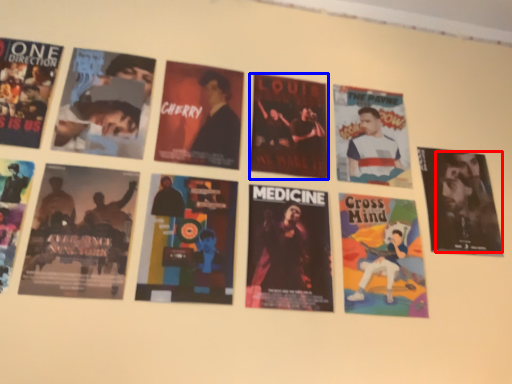
Question: Which object is further to the camera taking this photo, person (highlighted by a red box) or poster (highlighted by a blue box)?

Choices:
 (A) person
 (B) poster

Answer: (A)